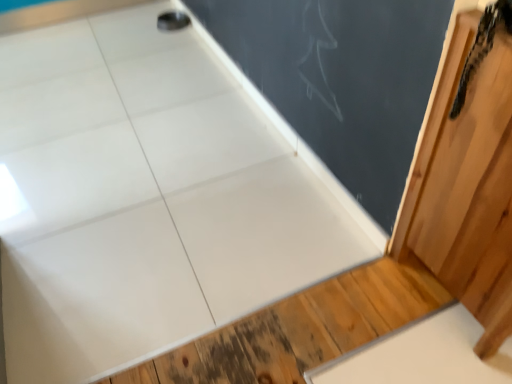
Question: Which is correct: black textured snake at upper right is inside wooden barn door at right, or outside of it?

Choices:
 (A) inside
 (B) outside

Answer: (A)

Question: Would you say black textured snake at upper right is to the left or to the right of wooden barn door at right in the picture?

Choices:
 (A) left
 (B) right

Answer: (A)

Question: Considering the real-world distances, which object is closest to the wooden barn door at right?

Choices:
 (A) black textured snake at upper right
 (B) matte black chalkboard at upper center

Answer: (A)

Question: Which of these objects is positioned farthest from the black textured snake at upper right?

Choices:
 (A) wooden barn door at right
 (B) matte black chalkboard at upper center

Answer: (B)